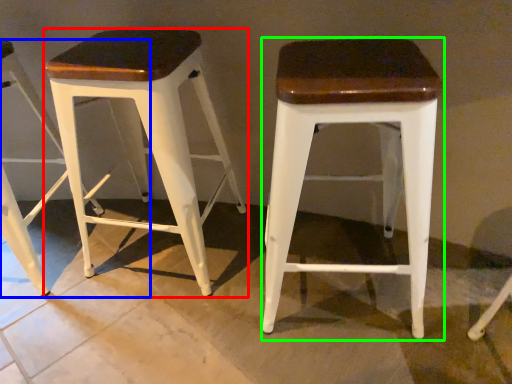
Question: Estimate the real-world distances between objects in this image. Which object is farther from stool (highlighted by a red box), stool (highlighted by a blue box) or stool (highlighted by a green box)?

Choices:
 (A) stool
 (B) stool

Answer: (B)